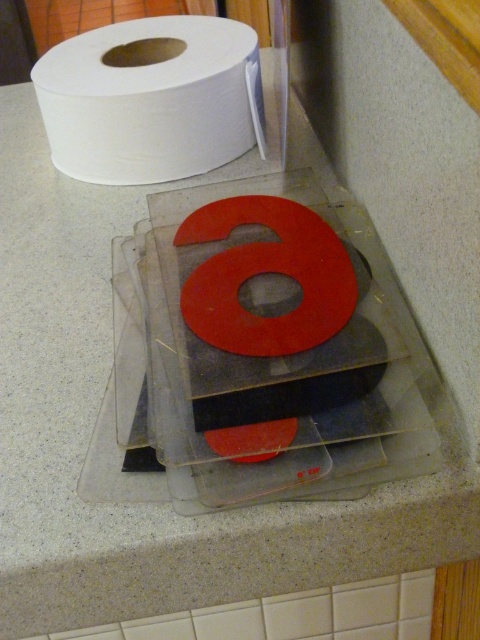
Can you confirm if white matte paper towel at upper left is thinner than matte red letter at center?

No.

This screenshot has width=480, height=640. In order to click on white matte paper towel at upper left in this screenshot , I will do `click(152, 99)`.

This screenshot has width=480, height=640. I want to click on white matte paper towel at upper left, so click(x=152, y=99).